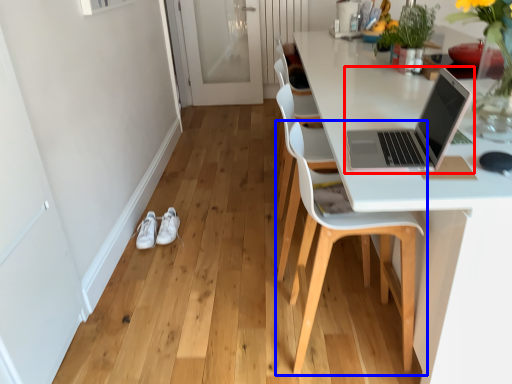
Question: Which object appears closest to the camera in this image, laptop (highlighted by a red box) or chair (highlighted by a blue box)?

Choices:
 (A) laptop
 (B) chair

Answer: (A)